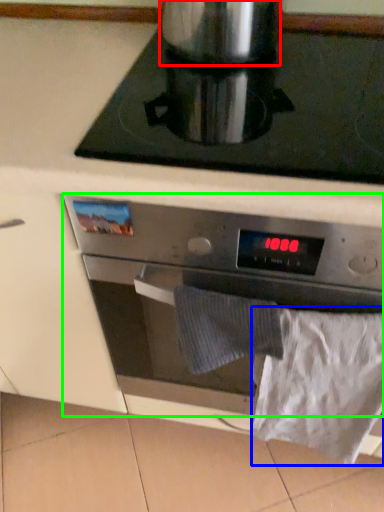
Question: Based on their relative distances, which object is farther from appliance (highlighted by a red box)? Choose from sheet (highlighted by a blue box) and kitchen appliance (highlighted by a green box).

Choices:
 (A) sheet
 (B) kitchen appliance

Answer: (A)